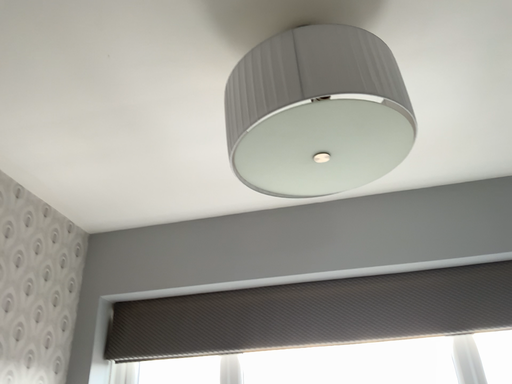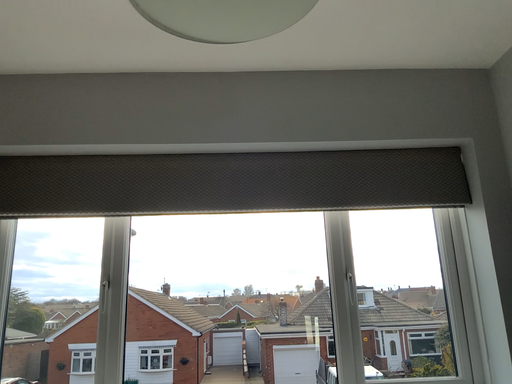
Question: Which way did the camera rotate in the video?

Choices:
 (A) rotated right
 (B) rotated left

Answer: (A)